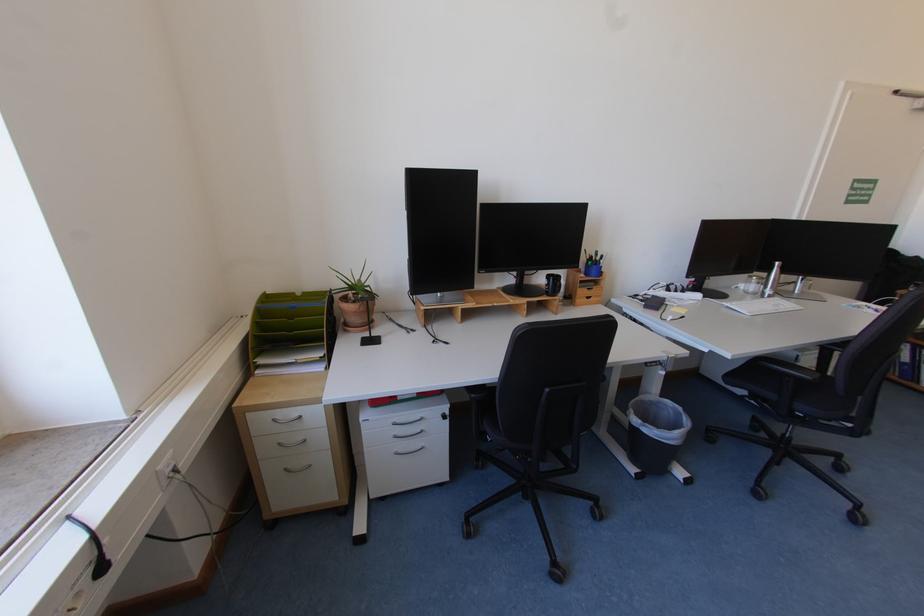
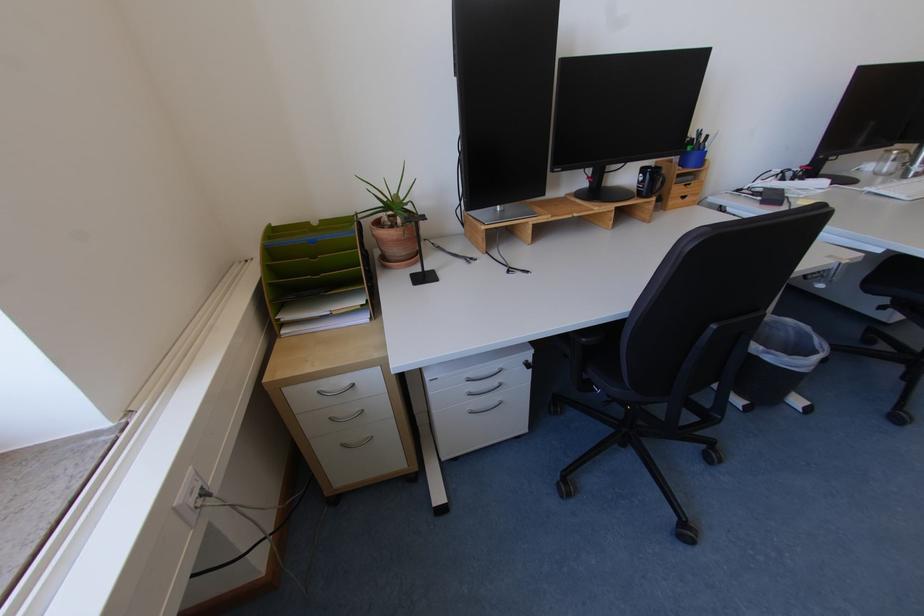
Find the pixel in the second image that matches the point at 647,472 in the first image.

(755, 403)